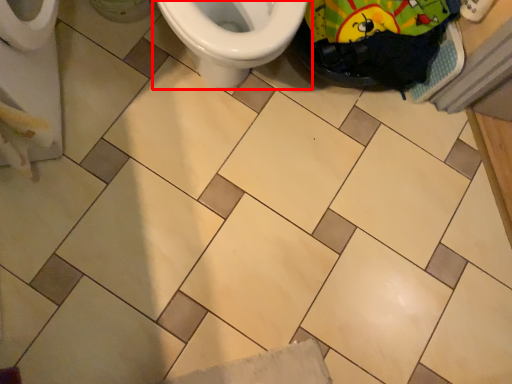
Question: Considering the relative positions of toilet (annotated by the red box) and material in the image provided, where is toilet (annotated by the red box) located with respect to the staircase?

Choices:
 (A) left
 (B) right

Answer: (A)